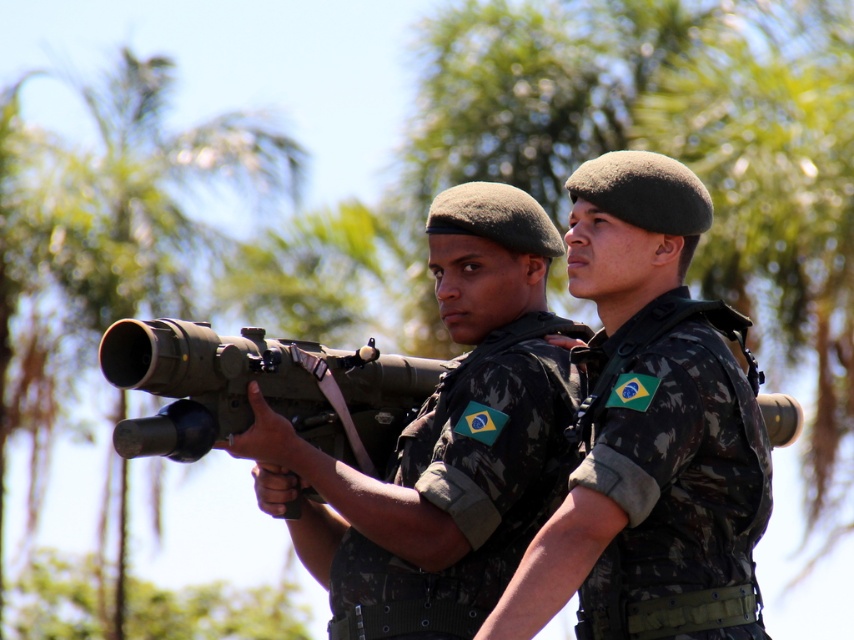
Question: Where is camouflage uniform at center located in relation to matte black rifle at center in the image?

Choices:
 (A) below
 (B) above

Answer: (B)

Question: Among these objects, which one is farthest from the camera?

Choices:
 (A) camo uniform at center
 (B) matte black rifle at center

Answer: (A)

Question: In this image, where is camo uniform at center located relative to camouflage fabric vest at center?

Choices:
 (A) above
 (B) below

Answer: (A)

Question: Which object appears closest to the camera in this image?

Choices:
 (A) matte black rifle at center
 (B) camo uniform at center

Answer: (A)

Question: Which of the following is the farthest from the observer?

Choices:
 (A) matte black rifle at center
 (B) camo uniform at center

Answer: (B)

Question: Can you confirm if camouflage uniform at center is bigger than camo uniform at center?

Choices:
 (A) no
 (B) yes

Answer: (A)